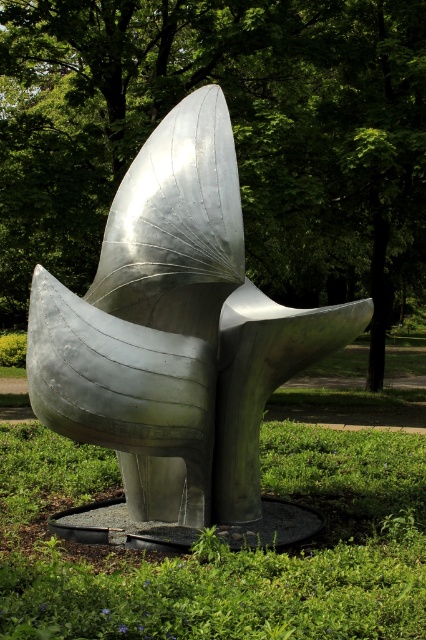
You are a park visitor who wants to take a photo of the polished metal sculpture at center without any obstructions. Given that the green leafy tree at center is nearby, will the tree block your view of the sculpture?

The green leafy tree at center has a larger size compared to the polished metal sculpture at center. Since the tree is larger, it might block part of the sculpture in your photo depending on their positions.

You are standing at the point marked as point (233,132) in the park. What object is located exactly at this point?

The green leafy tree at center is located exactly at point (233,132).

You are a landscape architect designing a garden and want to place a new bench between the green leafy tree at center and the green grass at center. Which object should the bench be closer to if you want it to be closer to the wider object?

The green leafy tree at center is wider than the green grass at center, so the bench should be placed closer to the green leafy tree at center.